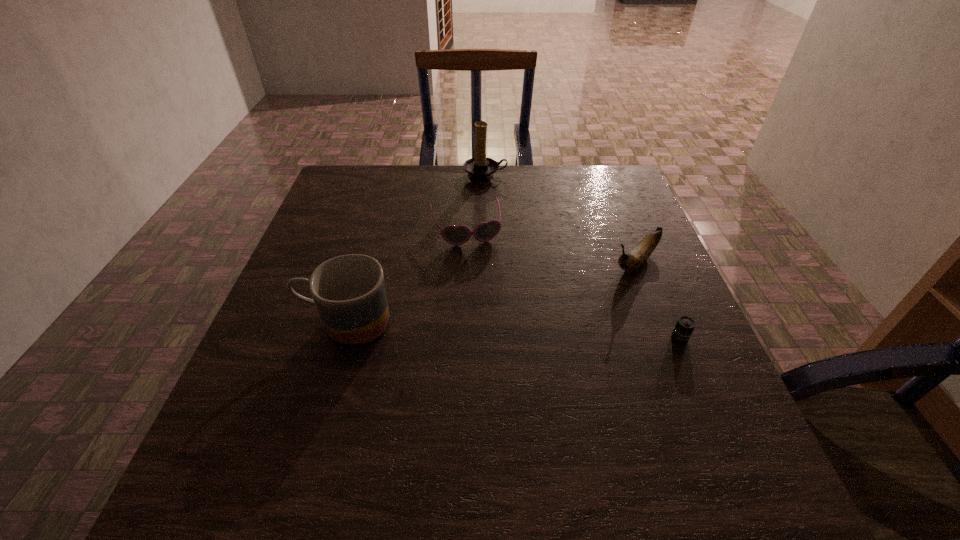
You are a GUI agent. You are given a task and a screenshot of the screen. Output one action in this format:
    pyautogui.click(x=<x>, y=<y>)
    Task: Click on the mug
    Image resolution: width=960 pixels, height=540 pixels.
    Given the screenshot: What is the action you would take?
    pyautogui.click(x=349, y=291)

Identify the location of the leftmost object. (349, 291).

At what (x,y) coordinates should I click in order to perform the action: click on beer can. Please return your answer as a coordinate pair (x, y). Looking at the image, I should click on (684, 327).

This screenshot has height=540, width=960. Find the location of `sunglasses`. sunglasses is located at coordinates (457, 235).

Identify the location of candle holder. The height and width of the screenshot is (540, 960). (480, 168).

Image resolution: width=960 pixels, height=540 pixels. Find the location of `the tallest object`. the tallest object is located at coordinates (480, 168).

Locate an element on the screen. banana is located at coordinates (633, 260).

I want to click on free region located 0.170m on the back of the beer can, so click(653, 276).

You are a GUI agent. You are given a task and a screenshot of the screen. Output one action in this format:
    pyautogui.click(x=<x>, y=<y>)
    Task: Click on the vacant space located 0.260m on the front-facing side of the second shortest object
    
    Given the screenshot: What is the action you would take?
    pyautogui.click(x=495, y=325)

At what (x,y) coordinates should I click in order to perform the action: click on free point located on the front-facing side of the second shortest object. Please return your answer as a coordinate pair (x, y). The width and height of the screenshot is (960, 540). Looking at the image, I should click on (508, 368).